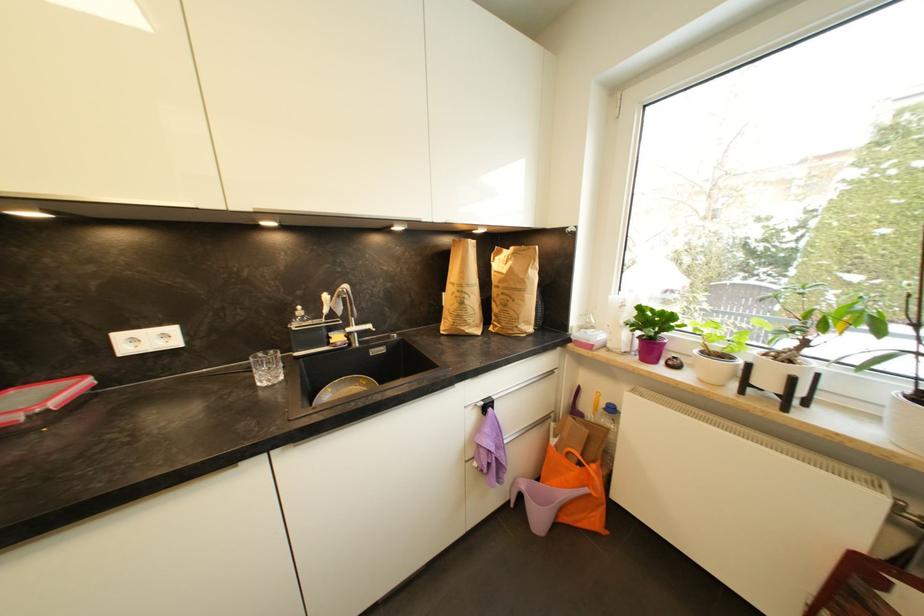
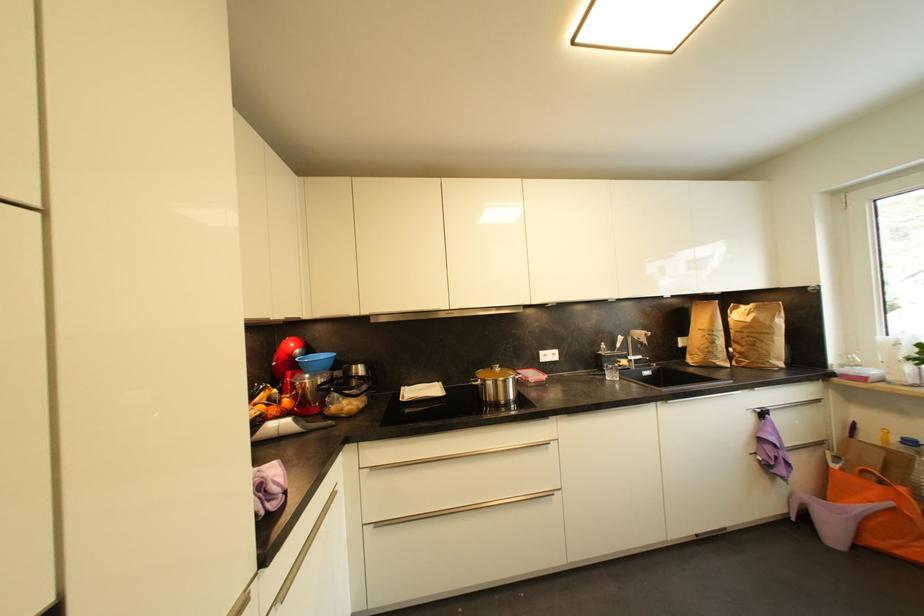
Question: I am providing you with two images of the same scene from different viewpoints. Please identify which objects are invisible in image2.

Choices:
 (A) small red container
 (B) pot lid handle
 (C) purple plastic object
 (D) none of these

Answer: (D)